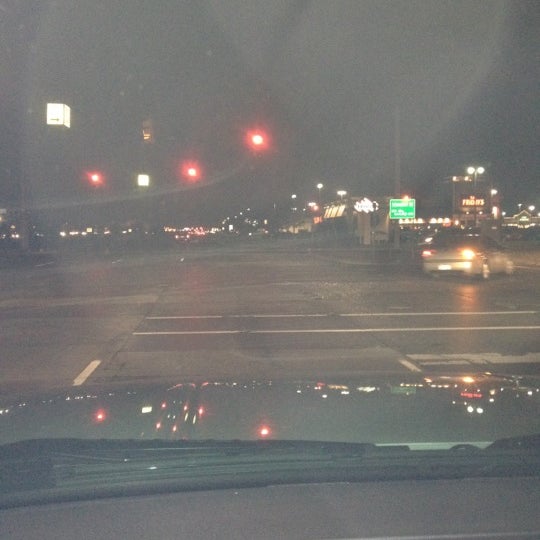
Locate an element on the screen. The image size is (540, 540). lights is located at coordinates (97, 180), (189, 174), (252, 140), (100, 416), (261, 435), (475, 396).